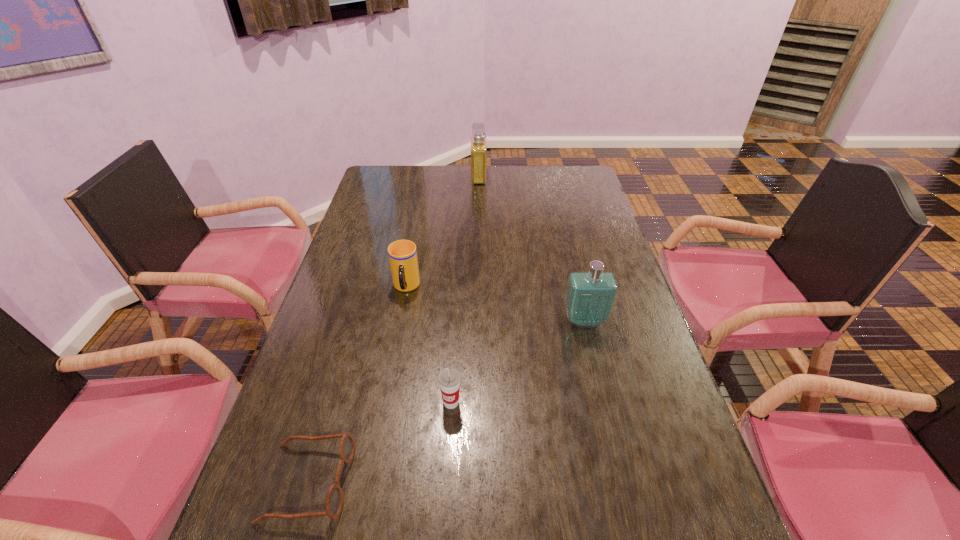
At what (x,y) coordinates should I click in order to perform the action: click on free space located 0.390m on the front-facing side of the second object from right to left. Please return your answer as a coordinate pair (x, y). This screenshot has height=540, width=960. Looking at the image, I should click on (581, 177).

Find the location of `free space located 0.240m on the front label of the rightmost object`. free space located 0.240m on the front label of the rightmost object is located at coordinates (607, 408).

The image size is (960, 540). I want to click on vacant space situated on the side of the fourth object from right to left with the handle, so click(x=396, y=341).

Locate an element on the screen. The height and width of the screenshot is (540, 960). vacant space located 0.070m on the side of the third object from left to right with the logo is located at coordinates (449, 441).

Identify the location of free space located 0.270m on the front-facing side of the shortest object. (484, 482).

Identify the location of object present at the far edge. The image size is (960, 540). (478, 139).

The width and height of the screenshot is (960, 540). I want to click on object at the left edge, so click(334, 503).

Find the location of a particular element. The image size is (960, 540). object that is at the right edge is located at coordinates (590, 297).

In the image, there is a desktop. At what (x,y) coordinates should I click in order to perform the action: click on free space at the far edge. Please return your answer as a coordinate pair (x, y). Image resolution: width=960 pixels, height=540 pixels. Looking at the image, I should click on (525, 168).

Find the location of a particular element. The height and width of the screenshot is (540, 960). free space at the left edge is located at coordinates [379, 301].